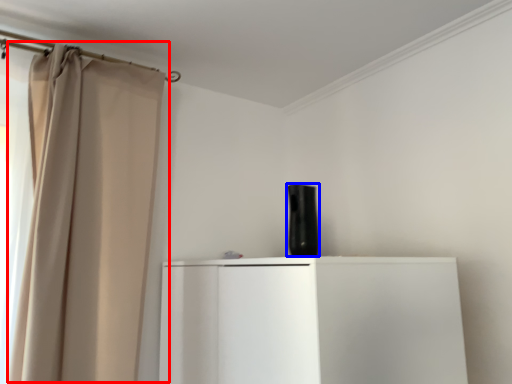
Question: Among these objects, which one is farthest to the camera, curtain (highlighted by a red box) or appliance (highlighted by a blue box)?

Choices:
 (A) curtain
 (B) appliance

Answer: (B)